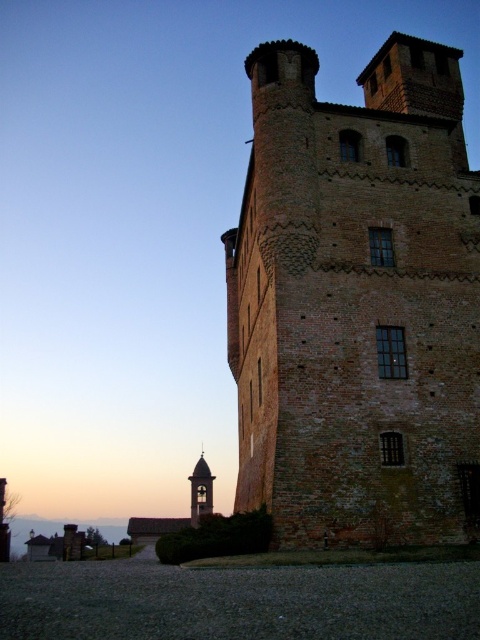
Question: Is brown brick tower at center right positioned behind smooth stone bell tower at lower center?

Choices:
 (A) no
 (B) yes

Answer: (A)

Question: Does brown brick tower at center right appear over smooth stone bell tower at lower center?

Choices:
 (A) yes
 (B) no

Answer: (A)

Question: Which point is closer to the camera taking this photo?

Choices:
 (A) click(197, 480)
 (B) click(245, 257)

Answer: (B)

Question: Does brown brick tower at center right have a greater width compared to smooth stone bell tower at lower center?

Choices:
 (A) no
 (B) yes

Answer: (B)

Question: Which object appears farthest from the camera in this image?

Choices:
 (A) brown brick tower at center right
 (B) smooth stone bell tower at lower center

Answer: (B)

Question: Which object is farther from the camera taking this photo?

Choices:
 (A) brown brick tower at center right
 (B) smooth stone bell tower at lower center

Answer: (B)